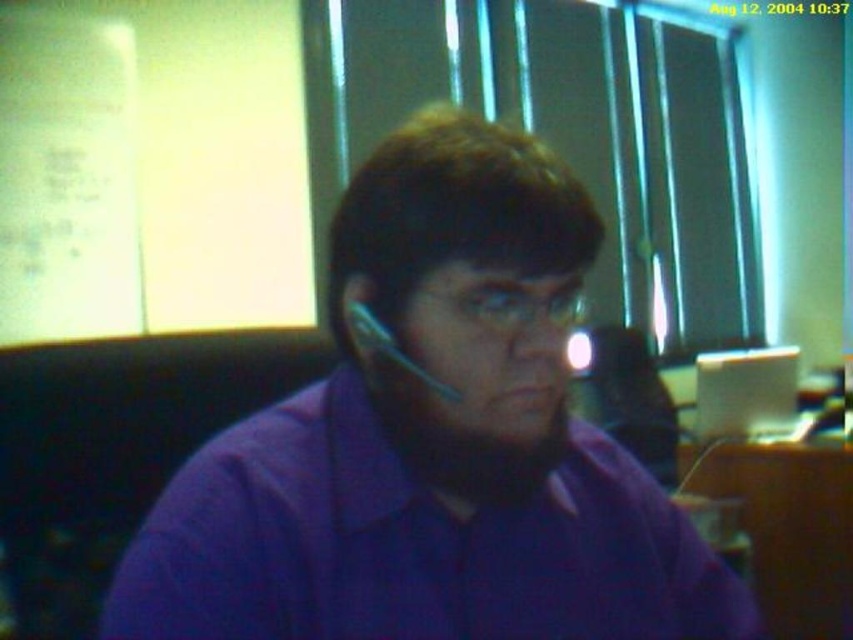
Between purple matte shirt at center and wooden desk at lower right, which one appears on the left side from the viewer's perspective?

Positioned to the left is purple matte shirt at center.

Can you confirm if purple matte shirt at center is shorter than wooden desk at lower right?

Yes.

Between point (564, 326) and point (850, 570), which one is positioned in front?

Point (564, 326)

Find the location of a particular element. purple matte shirt at center is located at coordinates (432, 442).

Is purple matte shirt at center wider than white glossy computer at center?

Yes.

Does purple matte shirt at center have a smaller size compared to white glossy computer at center?

No, purple matte shirt at center is not smaller than white glossy computer at center.

Between point (170, 486) and point (738, 385), which one is positioned in front?

Positioned in front is point (170, 486).

Identify the location of purple matte shirt at center. (432, 442).

Does wooden desk at lower right come in front of white glossy computer at center?

That is True.

From the picture: Does wooden desk at lower right appear on the right side of white glossy computer at center?

Indeed, wooden desk at lower right is positioned on the right side of white glossy computer at center.

This screenshot has height=640, width=853. Find the location of `wooden desk at lower right`. wooden desk at lower right is located at coordinates [x=788, y=528].